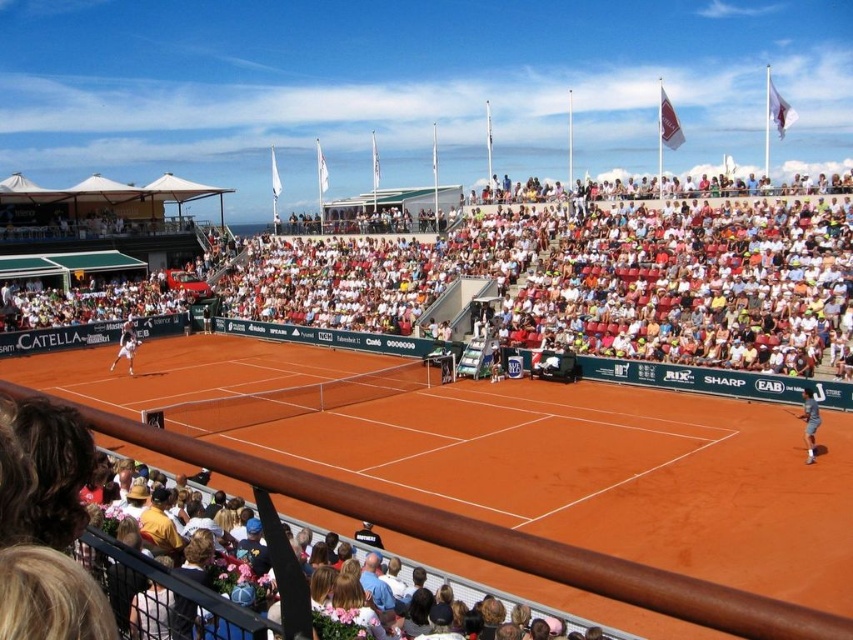
Measure the distance between point (376, 412) and camera.

Point (376, 412) and camera are 41.20 meters apart.

Who is more distant from viewer, (399,348) or (814,456)?

The point (399,348) is behind.

Image resolution: width=853 pixels, height=640 pixels. Identify the location of orange clay court at center. (561, 403).

Between point (804, 243) and point (132, 330), which one is positioned behind?

Point (132, 330)

Can you confirm if orange clay court at center is taller than white tennis racket at left?

Indeed, orange clay court at center has a greater height compared to white tennis racket at left.

Where is `orange clay court at center`? The width and height of the screenshot is (853, 640). orange clay court at center is located at coordinates (561, 403).

This screenshot has width=853, height=640. I want to click on orange clay court at center, so click(561, 403).

This screenshot has height=640, width=853. What are the coordinates of `orange clay court at center` in the screenshot? It's located at (561, 403).

Does orange clay court at center have a lesser width compared to white fabric seats at upper center?

Yes, orange clay court at center is thinner than white fabric seats at upper center.

What do you see at coordinates (561, 403) in the screenshot? The width and height of the screenshot is (853, 640). I see `orange clay court at center` at bounding box center [561, 403].

Locate an element on the screen. Image resolution: width=853 pixels, height=640 pixels. orange clay court at center is located at coordinates (561, 403).